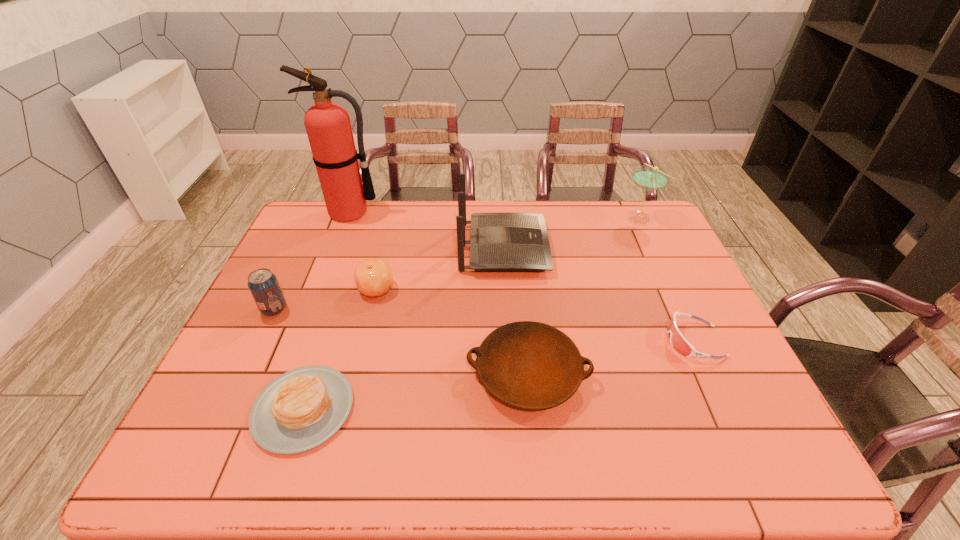
Locate an element on the screen. blank region between the goggles and the plate is located at coordinates (611, 357).

This screenshot has width=960, height=540. Identify the location of vacant space that's between the martini and the router. (572, 233).

Identify the location of unoccupied area between the martini and the router. Image resolution: width=960 pixels, height=540 pixels. (572, 233).

This screenshot has height=540, width=960. What are the coordinates of `blank region between the goggles and the router` in the screenshot? It's located at (599, 295).

Locate an element on the screen. This screenshot has width=960, height=540. vacant space that's between the fifth shortest object and the plate is located at coordinates (401, 342).

In order to click on vacant space that is in between the pancake and the plate in this screenshot , I will do (x=416, y=392).

Find the location of a particular element. The width and height of the screenshot is (960, 540). object that stands as the third closest to the martini is located at coordinates (528, 365).

Identify the location of object that is the fourth closest to the fourth shortest object. The image size is (960, 540). click(x=528, y=365).

Locate an element on the screen. vacant space that satisfies the following two spatial constraints: 1. at the nozzle of the fire extinguisher; 2. on the front-facing side of the router is located at coordinates (336, 248).

Identify the location of vacant space that satisfies the following two spatial constraints: 1. on the back side of the clementine; 2. on the right side of the martini. This screenshot has width=960, height=540. (394, 218).